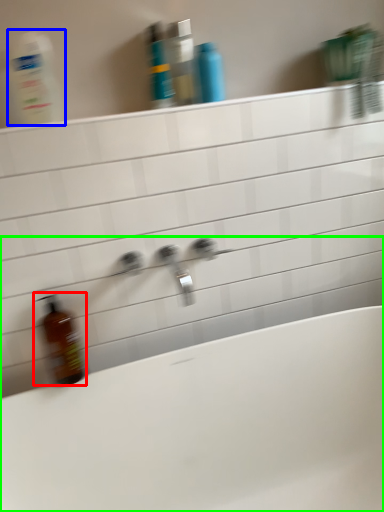
Question: Which object is positioned farthest from bottle (highlighted by a red box)? Select from cleaning product (highlighted by a blue box) and bathtub (highlighted by a green box).

Choices:
 (A) cleaning product
 (B) bathtub

Answer: (A)